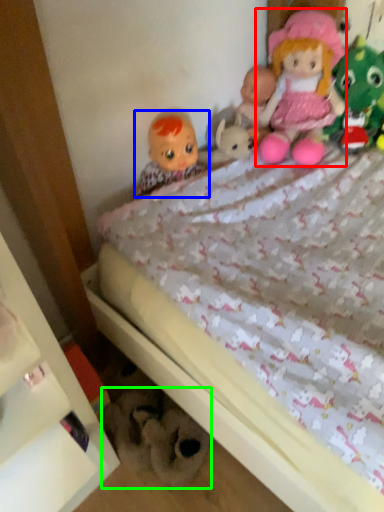
Question: Which is nearer to the doll (highlighted by a red box)? doll (highlighted by a blue box) or toy (highlighted by a green box).

Choices:
 (A) doll
 (B) toy

Answer: (A)